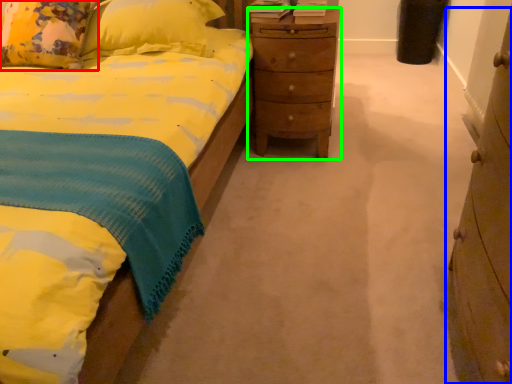
Question: Considering the real-world distances, which object is farthest from pillow (highlighted by a red box)? chest of drawers (highlighted by a blue box) or nightstand (highlighted by a green box)?

Choices:
 (A) chest of drawers
 (B) nightstand

Answer: (A)